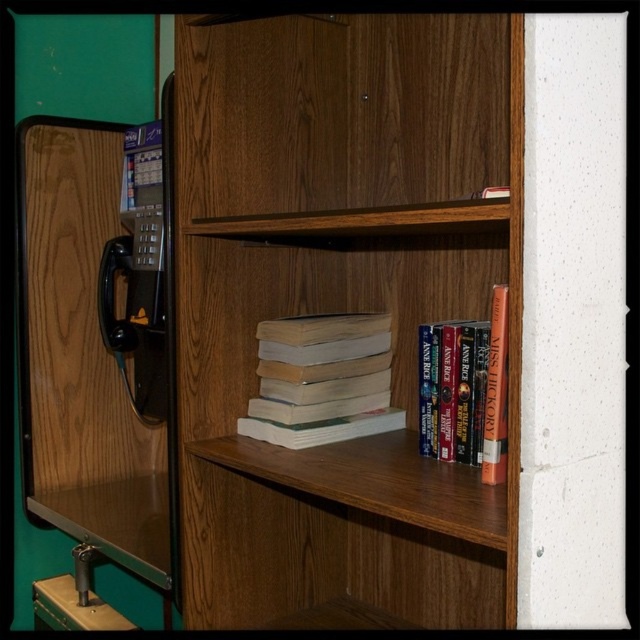
Which is more to the left, white matte book at center or hardcover book at center?

From the viewer's perspective, white matte book at center appears more on the left side.

This screenshot has width=640, height=640. Identify the location of white matte book at center. (323, 380).

Is wooden bookcase at center above metallic black phone at lower left?

Yes, wooden bookcase at center is above metallic black phone at lower left.

Can you confirm if wooden bookcase at center is thinner than metallic black phone at lower left?

Incorrect, wooden bookcase at center's width is not less than metallic black phone at lower left's.

The image size is (640, 640). Describe the element at coordinates (340, 307) in the screenshot. I see `wooden bookcase at center` at that location.

Identify the location of wooden bookcase at center. (340, 307).

Does wooden bookcase at center appear over white matte book at center?

Yes.

What do you see at coordinates (340, 307) in the screenshot? This screenshot has height=640, width=640. I see `wooden bookcase at center` at bounding box center [340, 307].

Find the location of a particular element. The width and height of the screenshot is (640, 640). wooden bookcase at center is located at coordinates (340, 307).